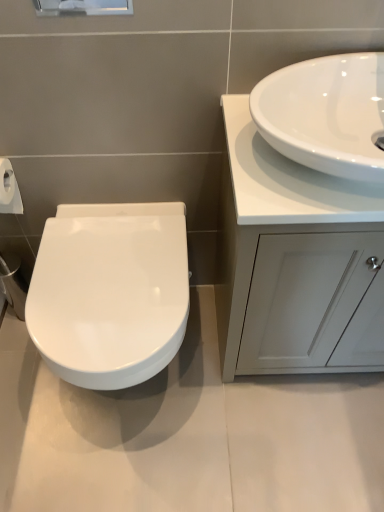
I want to click on free space in front of white glossy toilet at left, so click(x=127, y=471).